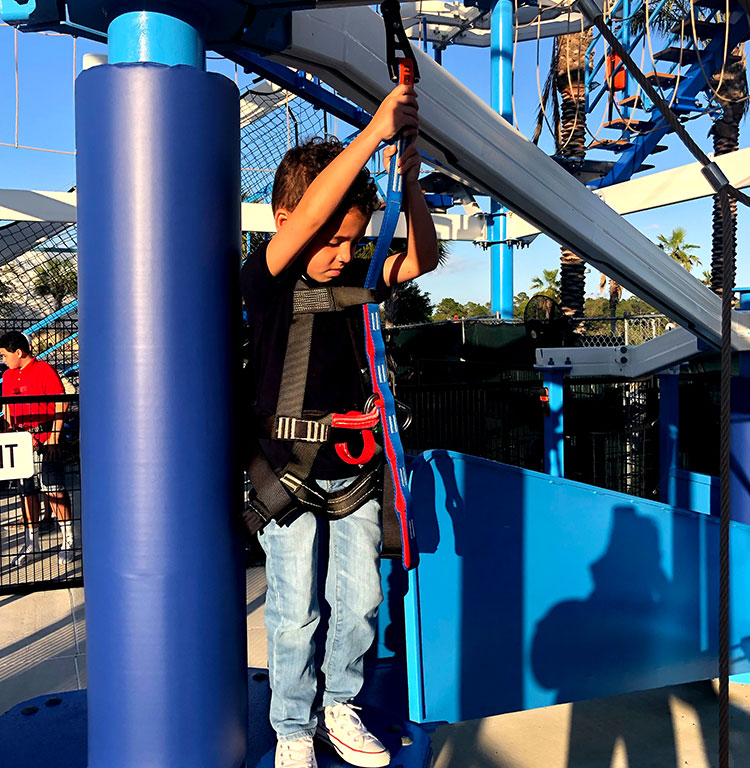
Where is `sock`? The width and height of the screenshot is (750, 768). sock is located at coordinates (34, 531), (69, 530).